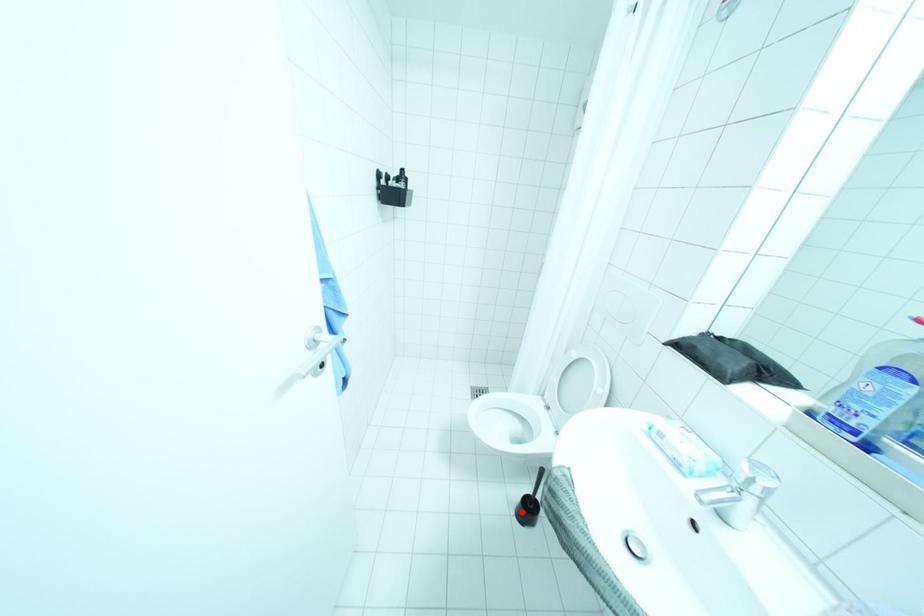
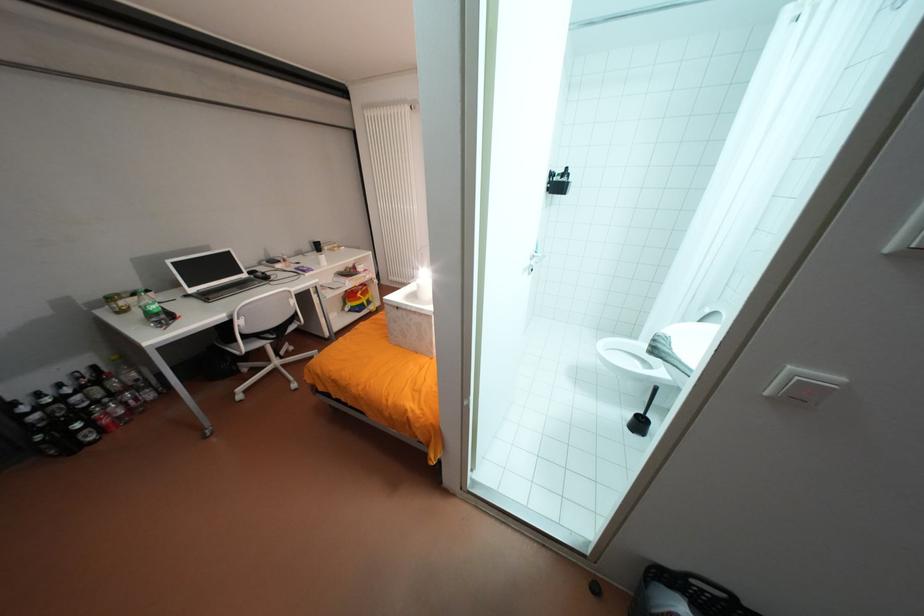
In the second image, find the point that corresponds to the highlighted location in the first image.

(634, 423)